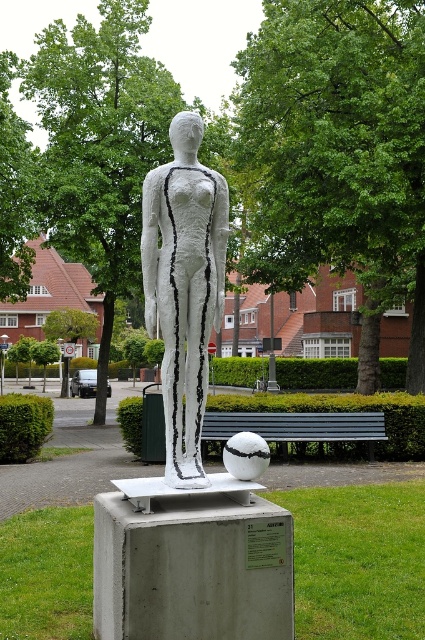
You are standing in the park and want to take a photo of the sculpture. The camera you have can focus on objects up to 5 meters away. Is the point at coordinates point [221,237] within the camera focus range?

The distance between point [221,237] and the viewer is 4.41 meters, which is within the camera focus range of up to 5 meters. Yes, the point is within range.

You are standing in the park and want to take a photo of the white matte sculpture at center. If you are at position 0.0, 0.0, where should you position yourself to capture the sculpture in the center of your camera frame?

To center the white matte sculpture at center in your camera frame, position yourself at coordinates (184, 285) as per the sculpture location.

You are an artist planning to photograph the white matte sculpture at center and the black wooden bench at center. To ensure both are fully visible in your composition, which object should you position closer to the camera?

The white matte sculpture at center is not as tall as the black wooden bench at center, so to ensure both are fully visible, you should position the white matte sculpture at center closer to the camera to compensate for its smaller height.